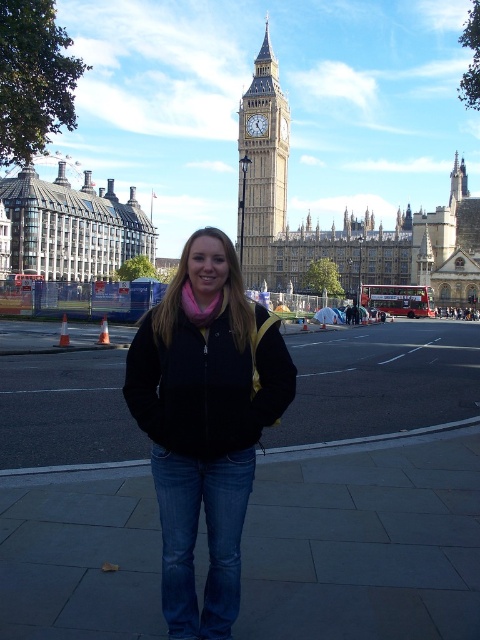
Question: Which point appears farthest from the camera in this image?

Choices:
 (A) (275, 148)
 (B) (173, 381)
 (C) (106, 214)

Answer: (C)

Question: Is black fleece jacket at center positioned before stone building at left?

Choices:
 (A) no
 (B) yes

Answer: (B)

Question: Which point appears farthest from the camera in this image?

Choices:
 (A) (262, 410)
 (B) (48, 202)
 (C) (248, 260)

Answer: (C)

Question: Does black fleece jacket at center have a greater width compared to stone building at left?

Choices:
 (A) yes
 (B) no

Answer: (B)

Question: Does black fleece jacket at center appear on the left side of stone building at left?

Choices:
 (A) yes
 (B) no

Answer: (B)

Question: Which point appears farthest from the camera in this image?

Choices:
 (A) (243, 173)
 (B) (25, 252)

Answer: (A)